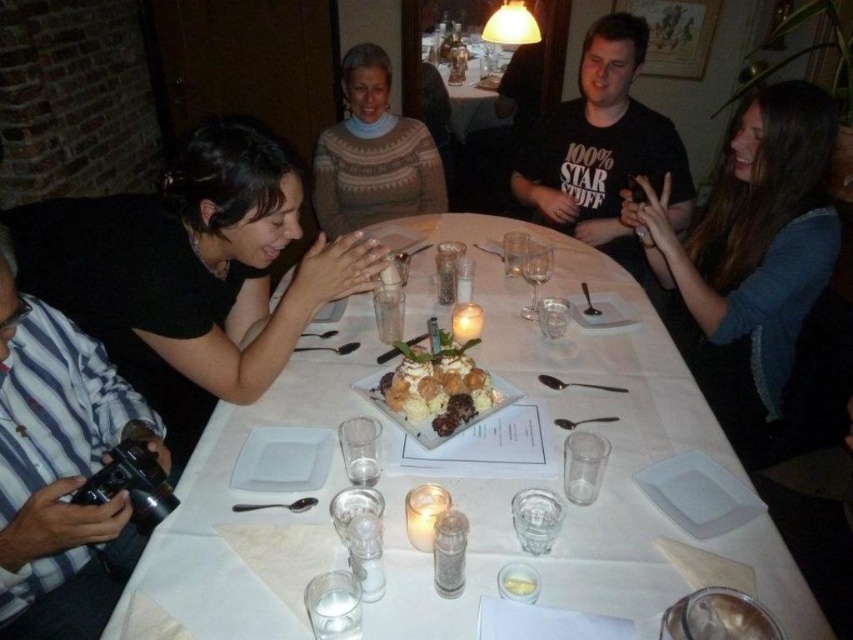
Question: Considering the real-world distances, which object is closest to the chocolate cake with whipped cream at center?

Choices:
 (A) blue sweater at upper right
 (B) white matte plate at center
 (C) white paper plate at upper left
 (D) matte glass candle at upper center

Answer: (C)

Question: Is blue sweater at upper right bigger than brown knitted sweater at center?

Choices:
 (A) yes
 (B) no

Answer: (A)

Question: Which point is closer to the camera?

Choices:
 (A) (229, 481)
 (B) (440, 115)
 (C) (560, 413)
 (D) (442, 396)

Answer: (A)

Question: Among these objects, which one is farthest from the camera?

Choices:
 (A) black matte shirt at left
 (B) brown knitted sweater at center
 (C) white matte plate at center

Answer: (B)

Question: Does black matte shirt at left come in front of chocolate cake with whipped cream at center?

Choices:
 (A) no
 (B) yes

Answer: (B)

Question: Does white matte plate at lower right come in front of matte glass candle at upper center?

Choices:
 (A) no
 (B) yes

Answer: (B)